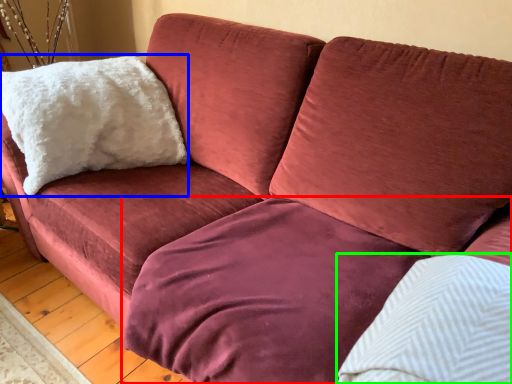
Question: Estimate the real-world distances between objects in this image. Which object is farther from bedding (highlighted by a red box), pillow (highlighted by a blue box) or pillow (highlighted by a green box)?

Choices:
 (A) pillow
 (B) pillow

Answer: (A)